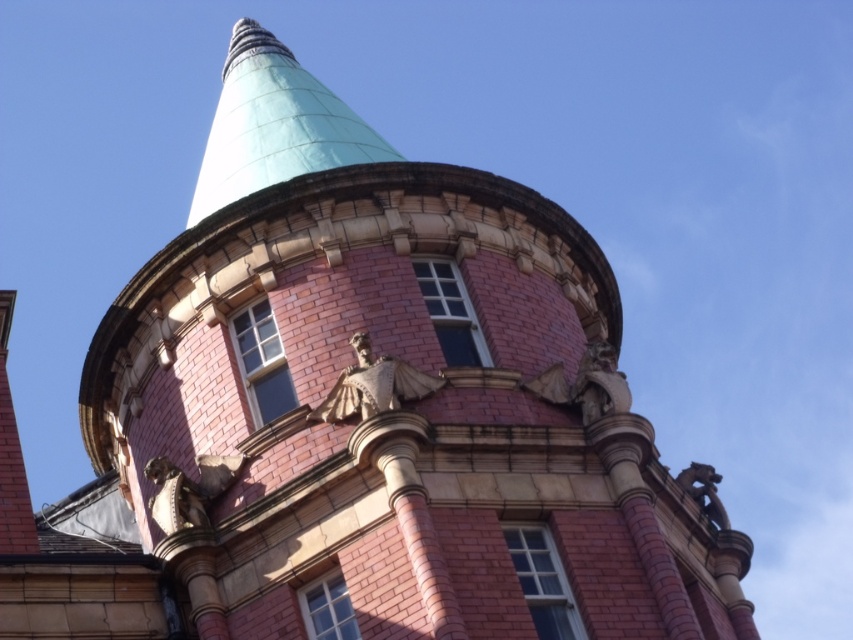
Question: Does gold metallic statue at center appear on the left side of bronze textured statue at lower left?

Choices:
 (A) no
 (B) yes

Answer: (A)

Question: Which of the following is the closest to the observer?

Choices:
 (A) bronze/golden statue at lower right
 (B) gold metallic statue at center

Answer: (B)

Question: Is bronze textured statue at lower left smaller than bronze/golden statue at lower right?

Choices:
 (A) no
 (B) yes

Answer: (B)

Question: Which object is closer to the camera taking this photo?

Choices:
 (A) bronze textured statue at lower left
 (B) polished bronze statue at upper center
 (C) bronze/golden statue at lower right

Answer: (A)

Question: Is gold metallic statue at center bigger than bronze textured statue at lower left?

Choices:
 (A) no
 (B) yes

Answer: (B)

Question: Which object appears farthest from the camera in this image?

Choices:
 (A) gold metallic statue at center
 (B) bronze/golden statue at lower right
 (C) bronze textured statue at lower left
 (D) polished bronze statue at upper center

Answer: (B)